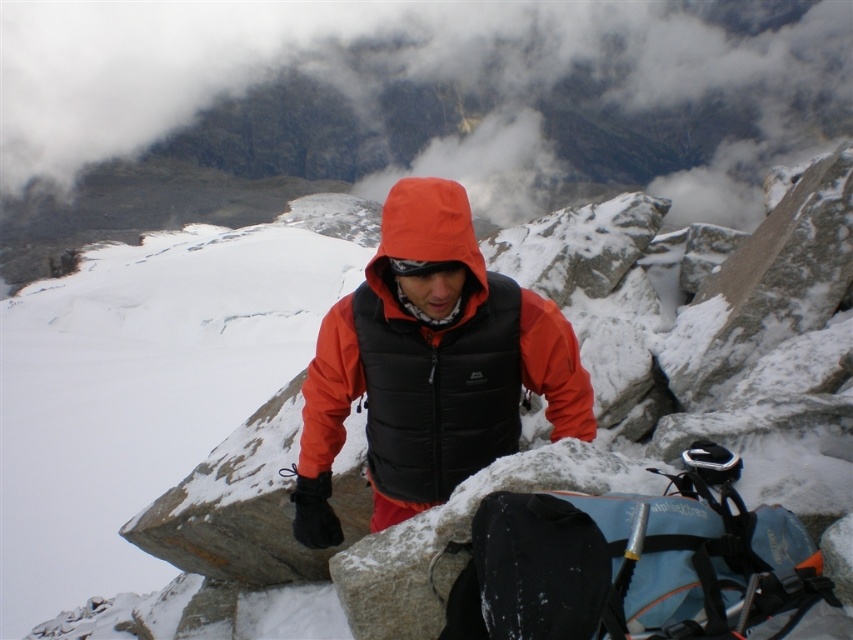
Question: Does cloudy fog at upper center lie in front of orange softshell jacket at center?

Choices:
 (A) yes
 (B) no

Answer: (B)

Question: Considering the relative positions of cloudy fog at upper center and orange softshell jacket at center in the image provided, where is cloudy fog at upper center located with respect to orange softshell jacket at center?

Choices:
 (A) right
 (B) left

Answer: (A)

Question: Can you confirm if cloudy fog at upper center is positioned above orange softshell jacket at center?

Choices:
 (A) yes
 (B) no

Answer: (A)

Question: Which of the following is the closest to the observer?

Choices:
 (A) orange softshell jacket at center
 (B) cloudy fog at upper center

Answer: (A)